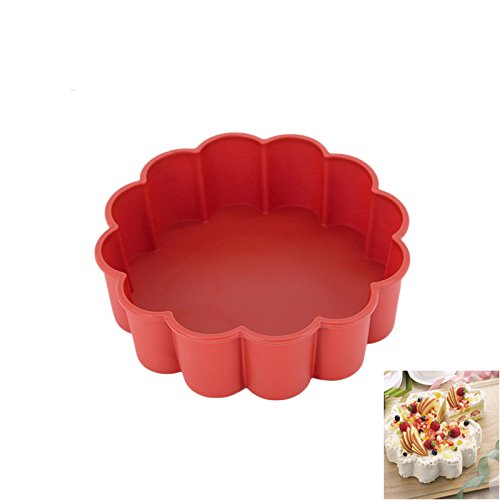
What are the coordinates of `red fruit decorations` in the screenshot? It's located at (437, 426), (401, 427), (456, 431), (428, 443).